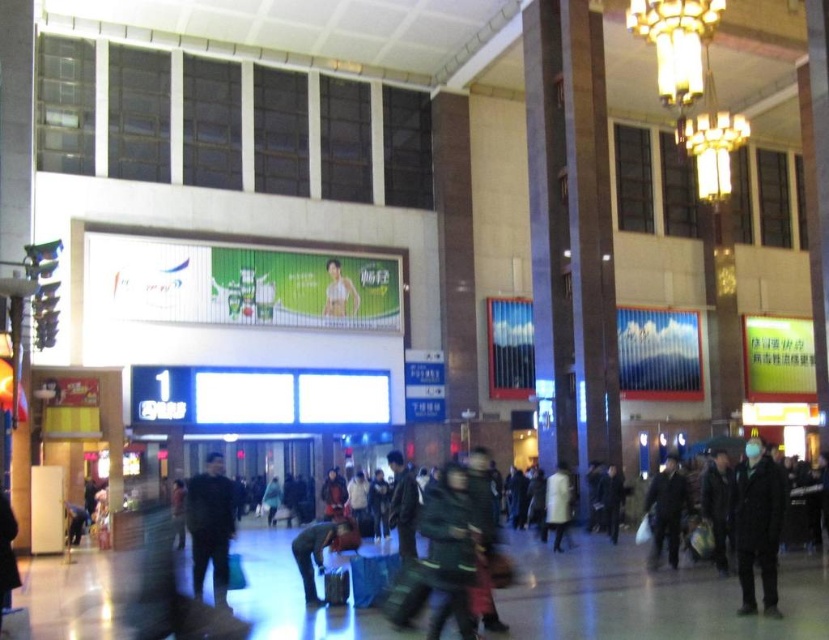
Question: Which object is closer to the camera taking this photo?

Choices:
 (A) dark matte clothing at center
 (B) dark gray wool coat at lower right
 (C) dark green jacket at center
 (D) dark green fabric bag at lower center

Answer: (A)

Question: Which object appears closest to the camera in this image?

Choices:
 (A) camouflage jacket at center
 (B) dark green fabric bag at lower center

Answer: (A)

Question: Is camouflage jacket at center positioned at the back of dark gray coat at center?

Choices:
 (A) yes
 (B) no

Answer: (B)

Question: Where is dark green fabric bag at lower center located in relation to white matte coat at center in the image?

Choices:
 (A) left
 (B) right

Answer: (A)

Question: Can you confirm if dark matte clothing at center is thinner than gold metallic chandelier at upper center?

Choices:
 (A) no
 (B) yes

Answer: (A)

Question: Which point is farther to the camera?

Choices:
 (A) (207, 538)
 (B) (723, 538)
 (C) (676, 88)
 (D) (432, 550)

Answer: (C)